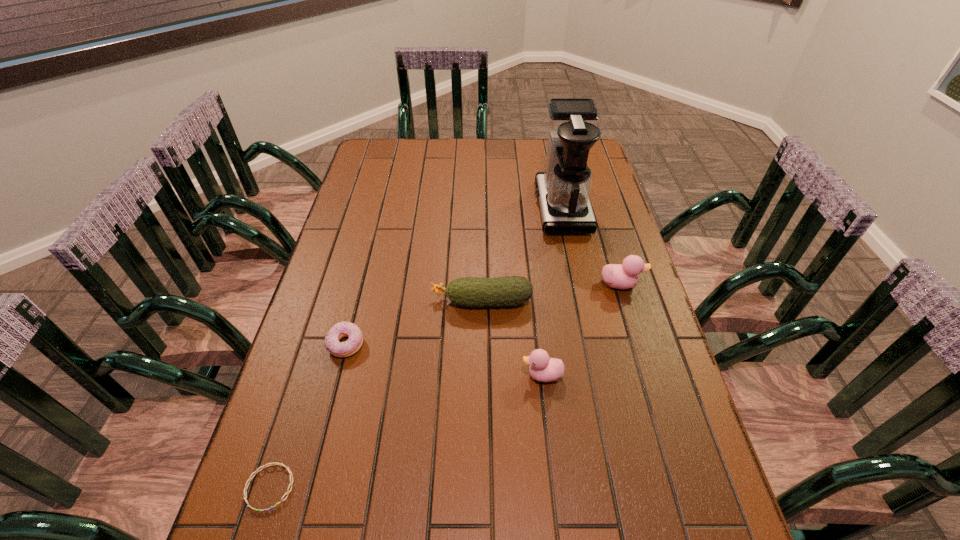
I want to click on vacant place for an extra duckling on the left, so click(425, 511).